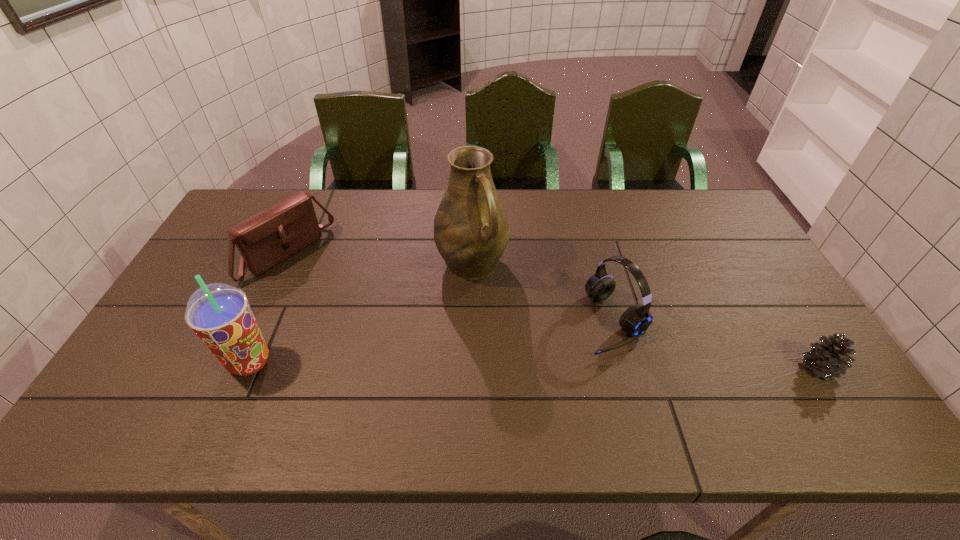
Where is `vacant space located 0.080m on the ear cushions of the headset`? vacant space located 0.080m on the ear cushions of the headset is located at coordinates click(568, 353).

This screenshot has width=960, height=540. I want to click on vacant region located 0.130m on the ear cushions of the headset, so click(552, 361).

Where is `free space located 0.050m on the handle side of the pitcher`? The width and height of the screenshot is (960, 540). free space located 0.050m on the handle side of the pitcher is located at coordinates (495, 301).

You are a GUI agent. You are given a task and a screenshot of the screen. Output one action in this format:
    pyautogui.click(x=<x>, y=<y>)
    Task: Click on the vacant area situated 0.190m on the handle side of the pitcher
    Image resolution: width=960 pixels, height=540 pixels.
    Given the screenshot: What is the action you would take?
    pyautogui.click(x=519, y=338)

Where is `blank space located 0.160m on the handle side of the pitcher`? The width and height of the screenshot is (960, 540). blank space located 0.160m on the handle side of the pitcher is located at coordinates (515, 329).

Image resolution: width=960 pixels, height=540 pixels. Identify the location of free spot located on the front flap of the shoulder bag. [400, 335].

The height and width of the screenshot is (540, 960). I want to click on vacant space located on the front flap of the shoulder bag, so click(x=348, y=299).

This screenshot has width=960, height=540. I want to click on vacant region located on the front flap of the shoulder bag, so click(x=324, y=284).

You are a GUI agent. You are given a task and a screenshot of the screen. Output one action in this format:
    pyautogui.click(x=<x>, y=<y>)
    Task: Click on the object that is positioned at the far edge
    The image size is (960, 540).
    Given the screenshot: What is the action you would take?
    pyautogui.click(x=267, y=238)

Where is `smoothie located in the near edge section of the desktop`? The width and height of the screenshot is (960, 540). smoothie located in the near edge section of the desktop is located at coordinates (220, 315).